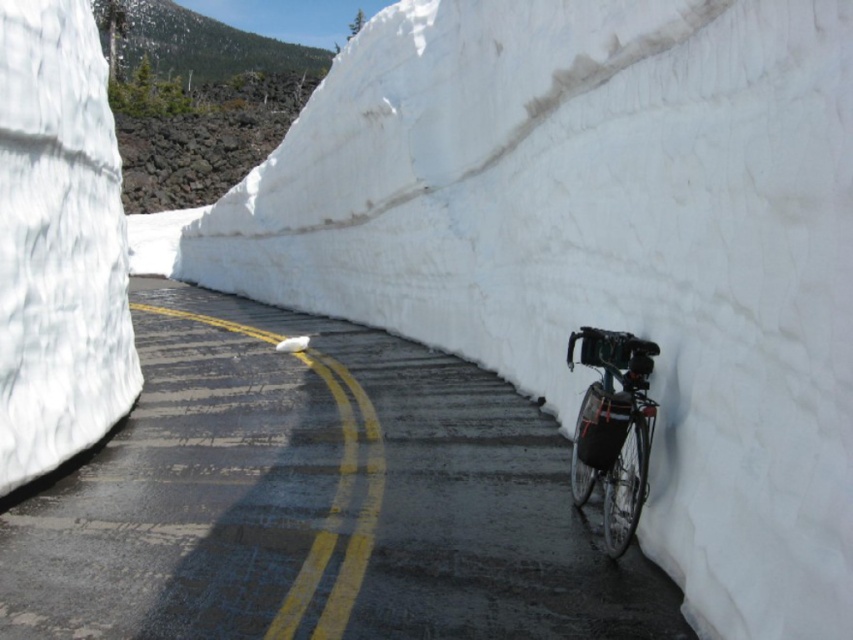
Between black asphalt road at center and shiny metallic bicycle at right, which one has more height?

Standing taller between the two is shiny metallic bicycle at right.

Who is positioned more to the right, black asphalt road at center or shiny metallic bicycle at right?

shiny metallic bicycle at right is more to the right.

Image resolution: width=853 pixels, height=640 pixels. What are the coordinates of `black asphalt road at center` in the screenshot? It's located at (315, 500).